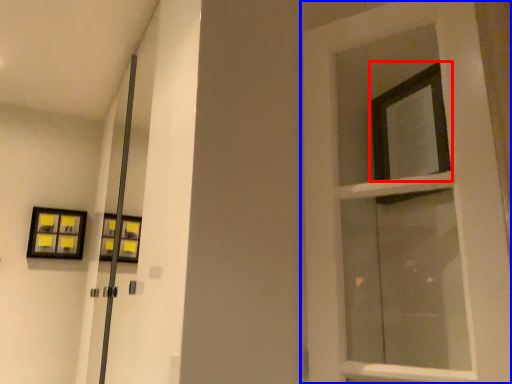
Question: Among these objects, which one is nearest to the camera, window (highlighted by a red box) or door (highlighted by a blue box)?

Choices:
 (A) window
 (B) door

Answer: (B)